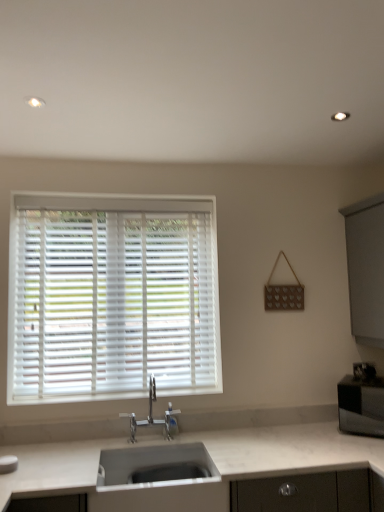
Question: Considering the relative sizes of satin black microwave at right and white marble countertop at lower center in the image provided, is satin black microwave at right thinner than white marble countertop at lower center?

Choices:
 (A) yes
 (B) no

Answer: (A)

Question: From a real-world perspective, is satin black microwave at right located beneath white marble countertop at lower center?

Choices:
 (A) no
 (B) yes

Answer: (A)

Question: From the image's perspective, is satin black microwave at right below white marble countertop at lower center?

Choices:
 (A) yes
 (B) no

Answer: (B)

Question: Does satin black microwave at right have a lesser height compared to white marble countertop at lower center?

Choices:
 (A) yes
 (B) no

Answer: (A)

Question: Does satin black microwave at right appear on the left side of white marble countertop at lower center?

Choices:
 (A) no
 (B) yes

Answer: (A)

Question: In terms of height, does satin black microwave at right look taller or shorter compared to polished chrome faucet at center?

Choices:
 (A) short
 (B) tall

Answer: (A)

Question: Considering the positions of satin black microwave at right and polished chrome faucet at center in the image, is satin black microwave at right wider or thinner than polished chrome faucet at center?

Choices:
 (A) wide
 (B) thin

Answer: (A)

Question: Is point (339, 414) closer or farther from the camera than point (170, 417)?

Choices:
 (A) closer
 (B) farther

Answer: (B)

Question: Based on their positions, is satin black microwave at right located to the left or right of polished chrome faucet at center?

Choices:
 (A) left
 (B) right

Answer: (B)

Question: Considering the positions of white marble countertop at lower center and polished chrome faucet at center in the image, is white marble countertop at lower center taller or shorter than polished chrome faucet at center?

Choices:
 (A) short
 (B) tall

Answer: (B)

Question: From a real-world perspective, is white marble countertop at lower center positioned above or below polished chrome faucet at center?

Choices:
 (A) below
 (B) above

Answer: (A)

Question: Looking at the image, does white marble countertop at lower center seem bigger or smaller compared to polished chrome faucet at center?

Choices:
 (A) small
 (B) big

Answer: (B)

Question: Is white marble countertop at lower center wider or thinner than polished chrome faucet at center?

Choices:
 (A) wide
 (B) thin

Answer: (A)

Question: Is white plastic blinds at upper left to the left or to the right of white marble countertop at lower center in the image?

Choices:
 (A) left
 (B) right

Answer: (A)

Question: From a real-world perspective, relative to white marble countertop at lower center, is white plastic blinds at upper left vertically above or below?

Choices:
 (A) below
 (B) above

Answer: (B)